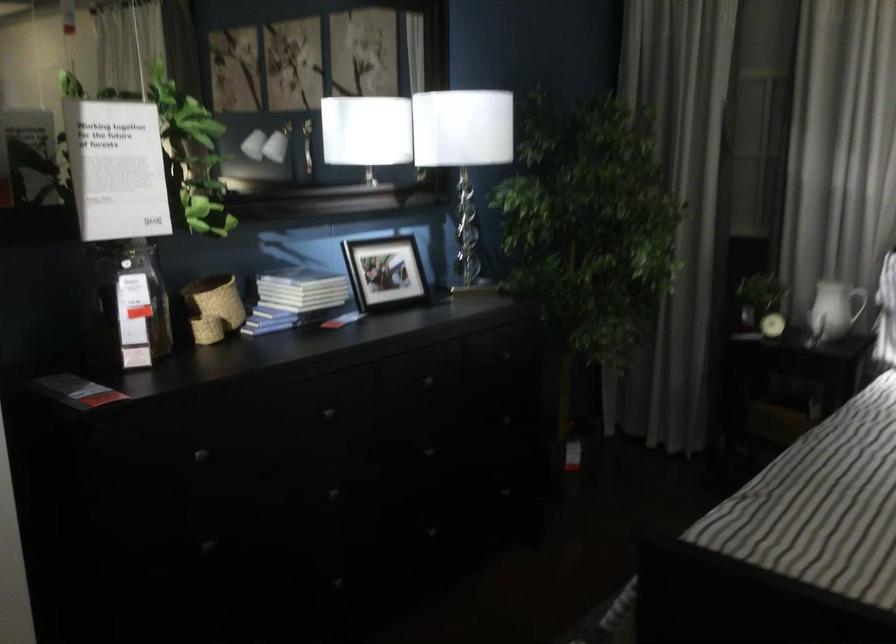
Which object does [126,305] point to?

It corresponds to the large glass jar in the image.